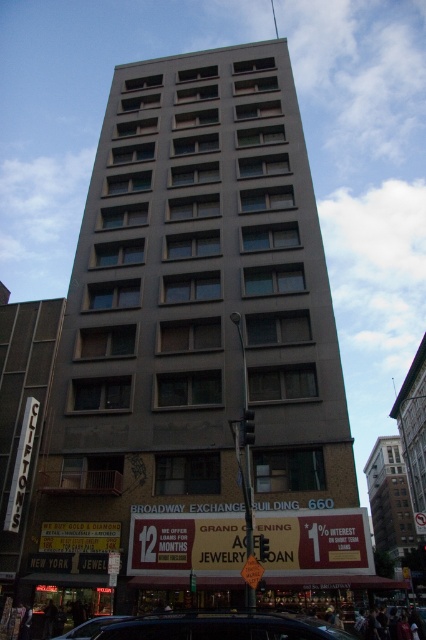
Based on the photo, you are a pedestrian standing in front of the Broadway Exchange Building 660. You see the gray concrete building at center and the shiny black car at lower center. Which object is closer to you?

The gray concrete building at center is closer to you because the shiny black car at lower center is behind it.

You are standing in front of the Broadway Exchange Building 660 and notice two shiny black cars. Which one is nearer to you, the shiny black car at lower center or the shiny black car at lower left?

The shiny black car at lower center is closer to the viewer than the shiny black car at lower left.